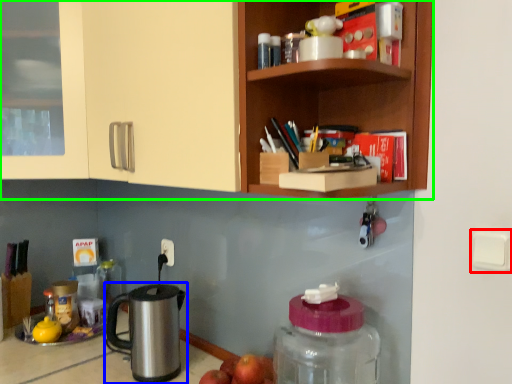
Question: Which object is positioned closest to light switch (highlighted by a red box)? Select from kettle (highlighted by a blue box) and cabinetry (highlighted by a green box).

Choices:
 (A) kettle
 (B) cabinetry

Answer: (B)